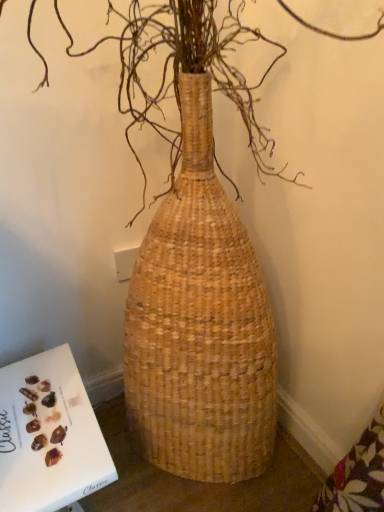
You are a GUI agent. You are given a task and a screenshot of the screen. Output one action in this format:
    pyautogui.click(x=<x>, y=<y>)
    Task: Click on the empty space that is ontop of white paper book at lower left (from a real-world perspective)
    
    Given the screenshot: What is the action you would take?
    pyautogui.click(x=46, y=413)